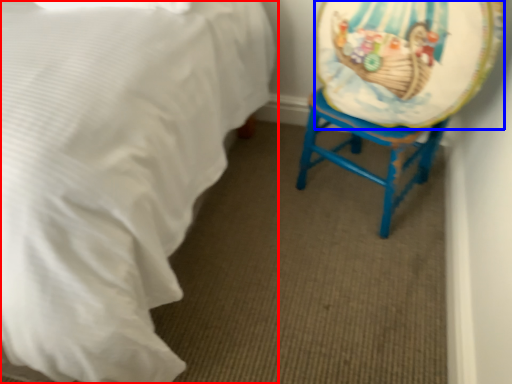
Question: Which of the following is the closest to the observer, bed (highlighted by a red box) or platter (highlighted by a blue box)?

Choices:
 (A) bed
 (B) platter

Answer: (A)